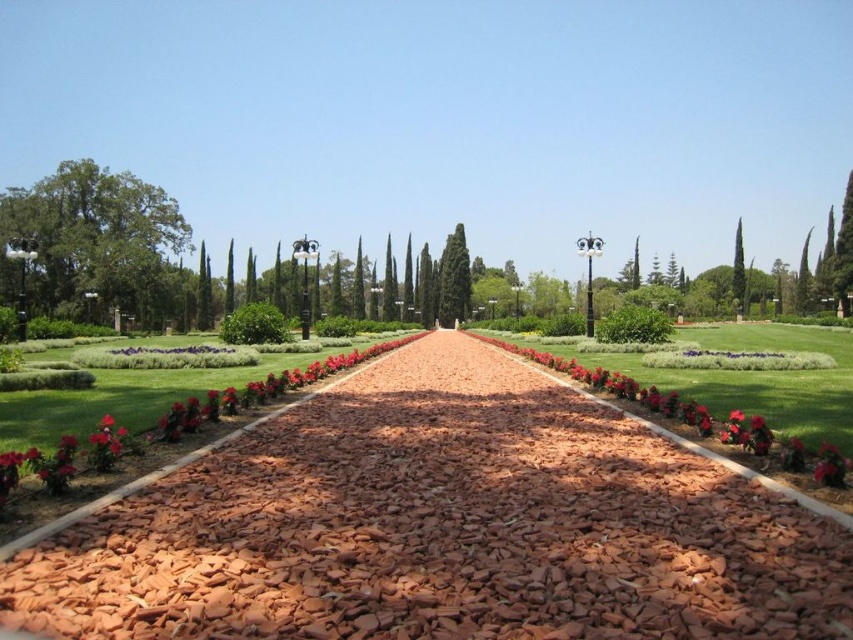
Who is more forward, [90,186] or [740,225]?

Point [90,186] is in front.

Is point (51, 176) positioned in front of point (734, 252)?

Yes.

Find the location of a particular element. This screenshot has width=853, height=640. green leafy tree at left is located at coordinates (91, 243).

Between point (660, 595) and point (172, 252), which one is positioned in front?

Point (660, 595) is in front.

Between point (299, 432) and point (74, 211), which one is positioned behind?

The point (74, 211) is more distant.

Who is more distant from viewer, (619,449) or (65,198)?

Positioned behind is point (65,198).

Image resolution: width=853 pixels, height=640 pixels. What are the coordinates of `red brick pathway at center` in the screenshot? It's located at (442, 528).

Is point (184, 237) positioned before point (469, 285)?

Yes, point (184, 237) is in front of point (469, 285).

Can you confirm if green leafy tree at left is shorter than green textured cypress at center?

Correct, green leafy tree at left is not as tall as green textured cypress at center.

Who is more forward, (x=64, y=202) or (x=461, y=266)?

Point (x=64, y=202)

Where is `green leafy tree at left`? Image resolution: width=853 pixels, height=640 pixels. green leafy tree at left is located at coordinates pyautogui.click(x=91, y=243).